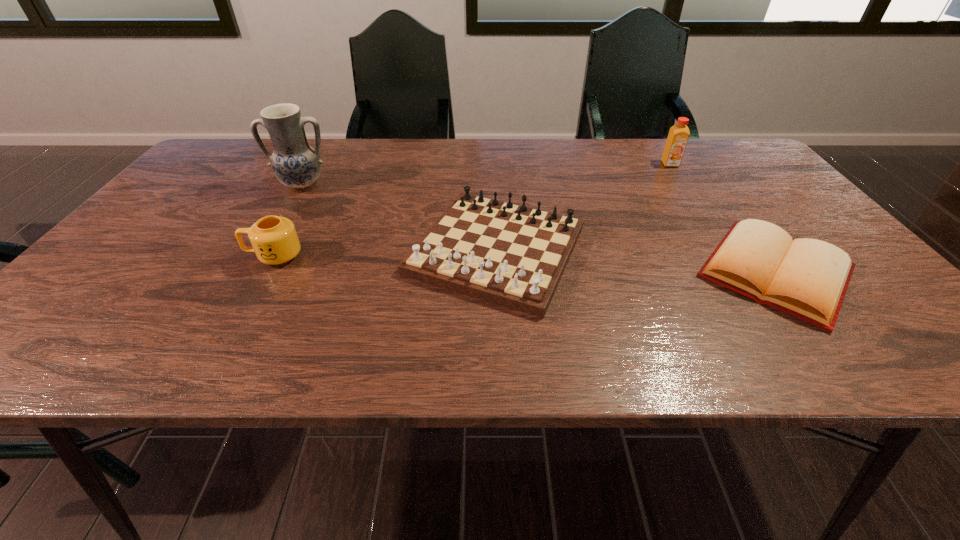
This screenshot has height=540, width=960. Identify the location of the fourth closest object to the shortest object. (295, 163).

Where is `free space that satisfies the following two spatial constraints: 1. on the handle side of the mug; 2. on the back side of the shortest object`? free space that satisfies the following two spatial constraints: 1. on the handle side of the mug; 2. on the back side of the shortest object is located at coordinates (265, 272).

In order to click on free space that satisfies the following two spatial constraints: 1. on the handle side of the shortest object; 2. on the right side of the third shortest object in this screenshot , I will do `click(265, 272)`.

At what (x,y) coordinates should I click in order to perform the action: click on blank space that satisfies the following two spatial constraints: 1. on the front and back of the farthest object; 2. on the right side of the Bible. Please return your answer as a coordinate pair (x, y). Image resolution: width=960 pixels, height=540 pixels. Looking at the image, I should click on (742, 272).

At what (x,y) coordinates should I click in order to perform the action: click on vacant space that satisfies the following two spatial constraints: 1. on the front side of the chessboard; 2. on the left side of the shortest object. Please return your answer as a coordinate pair (x, y). The width and height of the screenshot is (960, 540). Looking at the image, I should click on (497, 272).